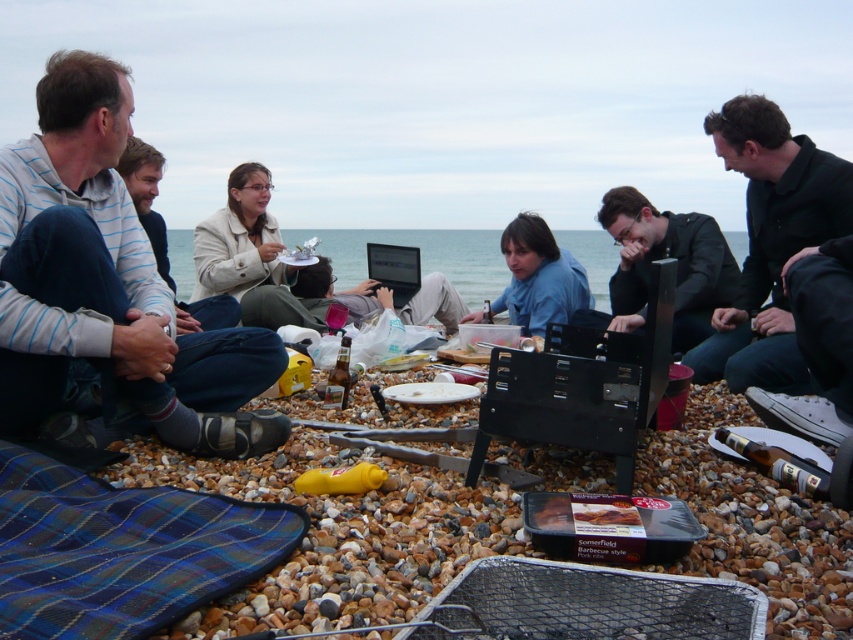
Question: Which object is farther from the camera taking this photo?

Choices:
 (A) light blue striped shirt at left
 (B) black matte jacket at center
 (C) black matte jacket at right

Answer: (B)

Question: Is light blue striped shirt at left to the right of black matte jacket at right from the viewer's perspective?

Choices:
 (A) yes
 (B) no

Answer: (B)

Question: Estimate the real-world distances between objects in this image. Which object is farther from the black matte jacket at center?

Choices:
 (A) black matte jacket at right
 (B) light beige jacket at center
 (C) light blue striped shirt at left

Answer: (C)

Question: Can you confirm if black matte jacket at center is smaller than light beige jacket at center?

Choices:
 (A) yes
 (B) no

Answer: (A)

Question: Where is light blue striped shirt at left located in relation to light beige jacket at center in the image?

Choices:
 (A) below
 (B) above

Answer: (A)

Question: Among these objects, which one is farthest from the camera?

Choices:
 (A) black matte jacket at center
 (B) light blue striped shirt at left

Answer: (A)